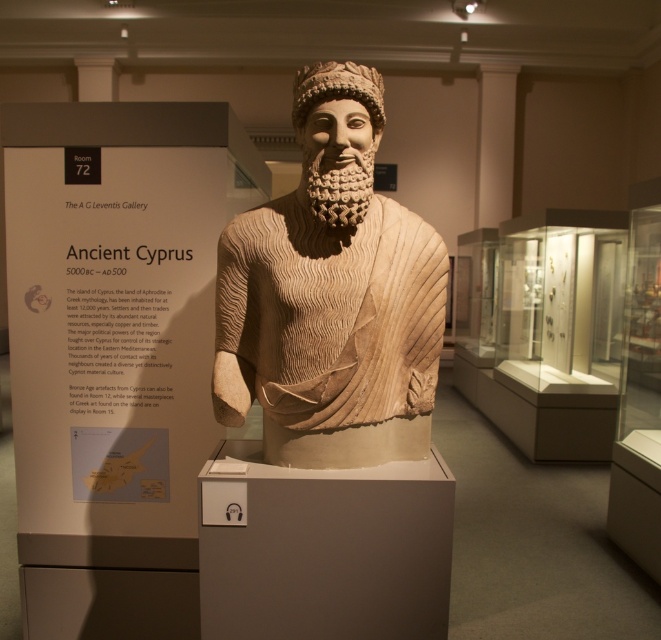
Question: Which object is farther from the camera taking this photo?

Choices:
 (A) beige textured beard at center
 (B) beige stone bust at center

Answer: (A)

Question: Can you confirm if beige stone bust at center is positioned above beige textured beard at center?

Choices:
 (A) no
 (B) yes

Answer: (A)

Question: Does beige stone bust at center have a larger size compared to beige textured beard at center?

Choices:
 (A) no
 (B) yes

Answer: (B)

Question: Is beige stone bust at center to the left of beige textured beard at center from the viewer's perspective?

Choices:
 (A) yes
 (B) no

Answer: (A)

Question: Among these objects, which one is farthest from the camera?

Choices:
 (A) beige textured beard at center
 (B) beige stone bust at center

Answer: (A)

Question: Which of the following is the closest to the observer?

Choices:
 (A) (352, 310)
 (B) (344, 179)

Answer: (B)